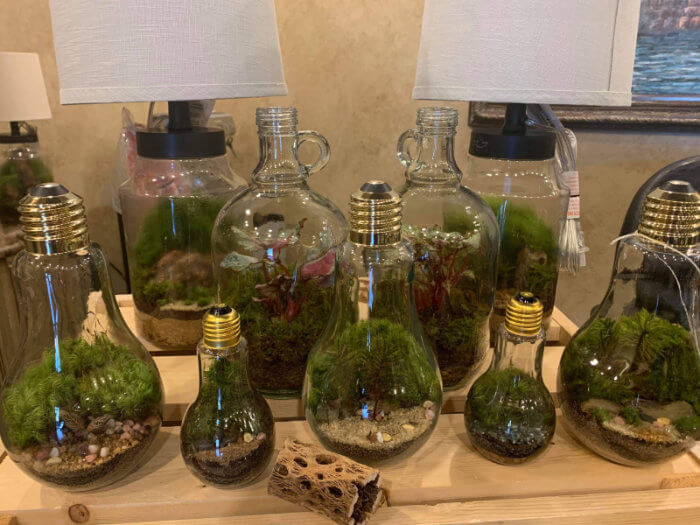
You are a GUI agent. You are given a task and a screenshot of the screen. Output one action in this format:
    pyautogui.click(x=<x>, y=<y>)
    Task: Click on the jug
    This screenshot has height=525, width=700.
    Given the screenshot: What is the action you would take?
    pyautogui.click(x=442, y=236), pyautogui.click(x=273, y=230)